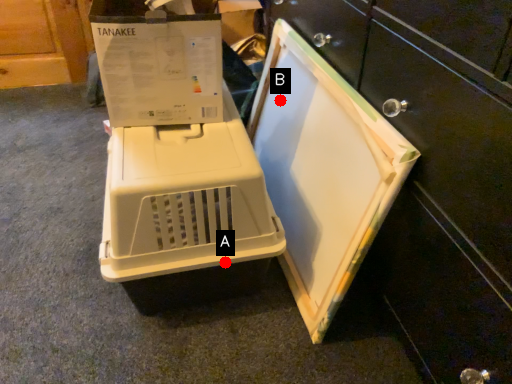
Question: Two points are circled on the image, labeled by A and B beside each circle. Among these points, which one is nearest to the camera?

Choices:
 (A) A is closer
 (B) B is closer

Answer: (A)